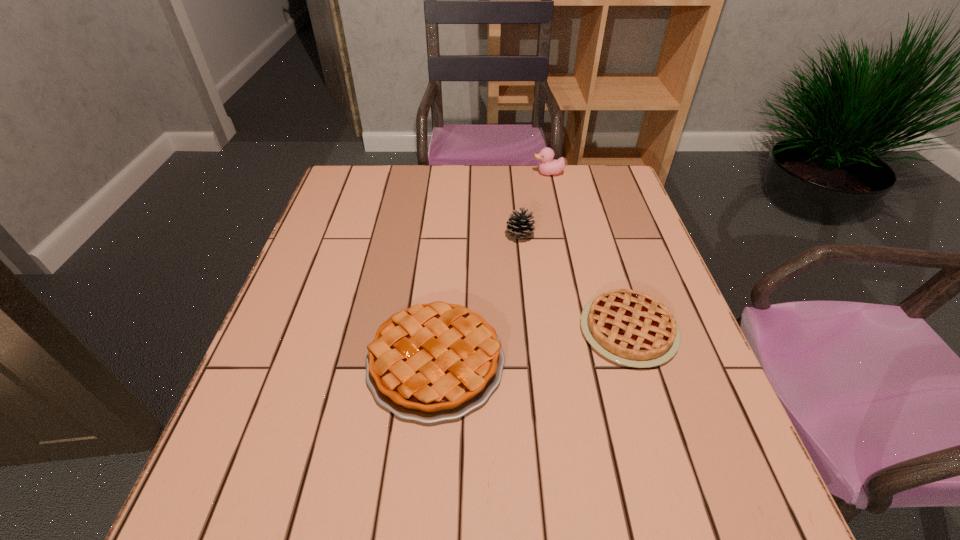
The height and width of the screenshot is (540, 960). In order to click on vacant position located 0.350m on the left of the second object from left to right in this screenshot , I will do `click(374, 235)`.

The width and height of the screenshot is (960, 540). Find the location of `free space located 0.290m on the back of the left pie`. free space located 0.290m on the back of the left pie is located at coordinates (447, 230).

At what (x,y) coordinates should I click in order to perform the action: click on free region located 0.260m on the back of the right pie. Please return your answer as a coordinate pair (x, y). The width and height of the screenshot is (960, 540). Looking at the image, I should click on pyautogui.click(x=596, y=226).

At what (x,y) coordinates should I click in order to perform the action: click on object located in the far edge section of the desktop. Please return your answer as a coordinate pair (x, y). The image size is (960, 540). Looking at the image, I should click on (547, 166).

The width and height of the screenshot is (960, 540). Identify the location of object situated at the right edge. (631, 328).

The height and width of the screenshot is (540, 960). In order to click on vacant space at the far edge of the desktop in this screenshot , I will do `click(491, 165)`.

In the image, there is a desktop. Where is `blank space at the left edge`? The width and height of the screenshot is (960, 540). blank space at the left edge is located at coordinates (350, 215).

Locate an element on the screen. The width and height of the screenshot is (960, 540). vacant area at the right edge of the desktop is located at coordinates (604, 278).

Identify the location of vacant space at the far left corner. The width and height of the screenshot is (960, 540). (365, 165).

Image resolution: width=960 pixels, height=540 pixels. What are the coordinates of `vacant area at the near left corner` in the screenshot? It's located at (257, 534).